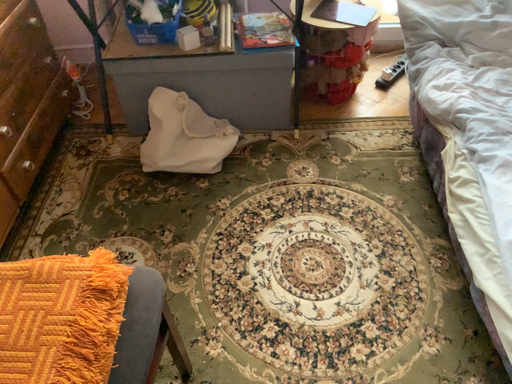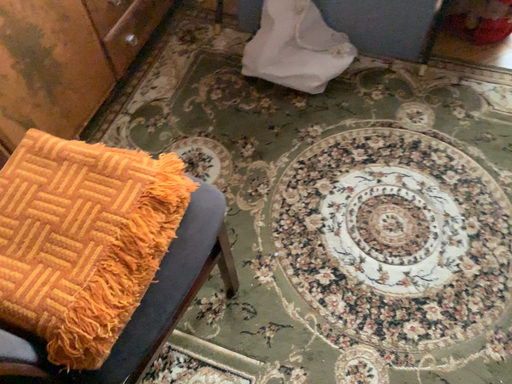
Question: Which way did the camera rotate in the video?

Choices:
 (A) rotated downward
 (B) rotated upward

Answer: (A)